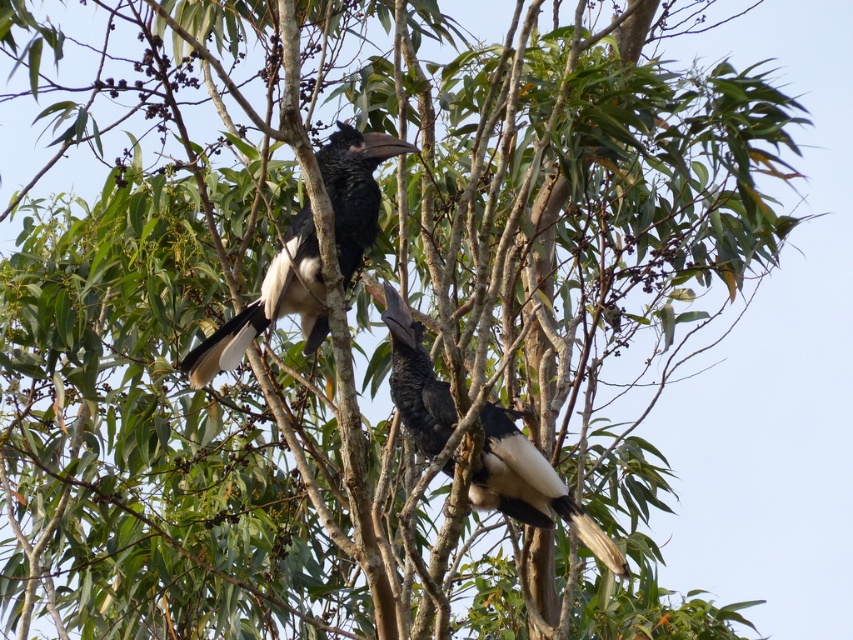
Question: Does black glossy hornbill at center come behind black matte hornbill at center?

Choices:
 (A) no
 (B) yes

Answer: (A)

Question: Is black glossy hornbill at center wider than black matte hornbill at center?

Choices:
 (A) yes
 (B) no

Answer: (B)

Question: Which of the following is the farthest from the observer?

Choices:
 (A) (344, 182)
 (B) (395, 323)

Answer: (A)

Question: Is black glossy hornbill at center wider than black matte hornbill at center?

Choices:
 (A) yes
 (B) no

Answer: (B)

Question: Which point is closer to the camera taking this photo?

Choices:
 (A) (310, 276)
 (B) (496, 445)

Answer: (B)